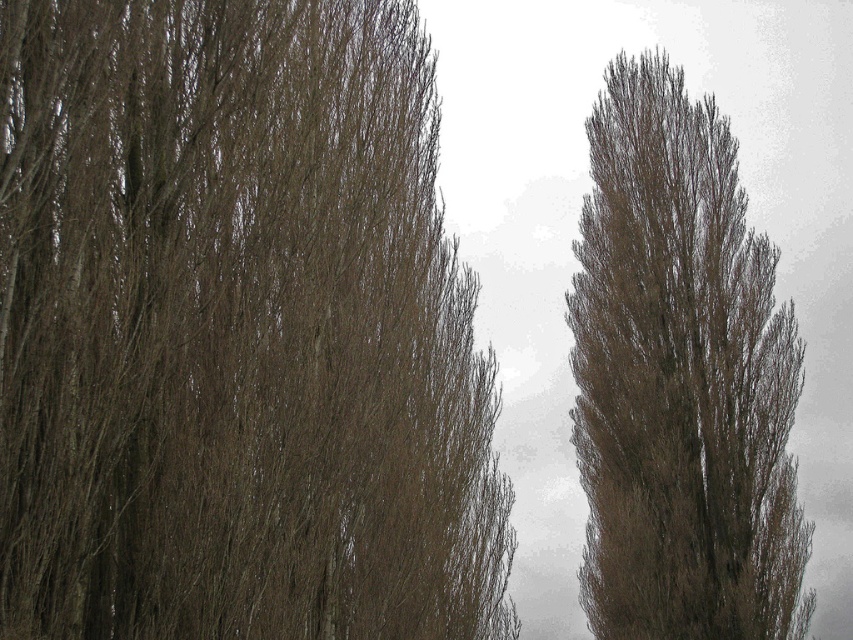
Question: Which point is farther to the camera?

Choices:
 (A) brown textured tree at center
 (B) brown textured tree at right

Answer: (B)

Question: Is brown textured tree at center further to the viewer compared to brown textured tree at right?

Choices:
 (A) yes
 (B) no

Answer: (B)

Question: Does brown textured tree at center appear over brown textured tree at right?

Choices:
 (A) yes
 (B) no

Answer: (A)

Question: Is brown textured tree at center wider than brown textured tree at right?

Choices:
 (A) no
 (B) yes

Answer: (A)